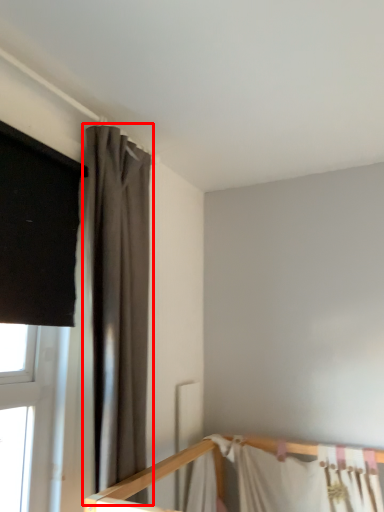
Question: From the image, what is the correct spatial relationship of curtain (annotated by the red box) in relation to bed?

Choices:
 (A) right
 (B) left

Answer: (B)